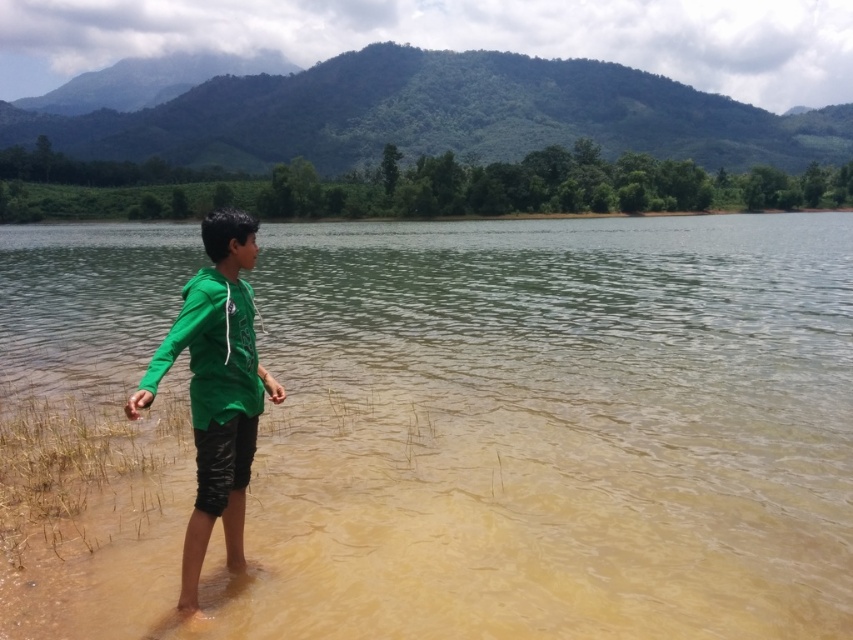
Which is below, brown muddy water at center or green matte hoodie at center?

green matte hoodie at center is lower down.

Which is above, brown muddy water at center or green matte hoodie at center?

brown muddy water at center is higher up.

Find the location of a particular element. This screenshot has height=640, width=853. brown muddy water at center is located at coordinates coord(552,429).